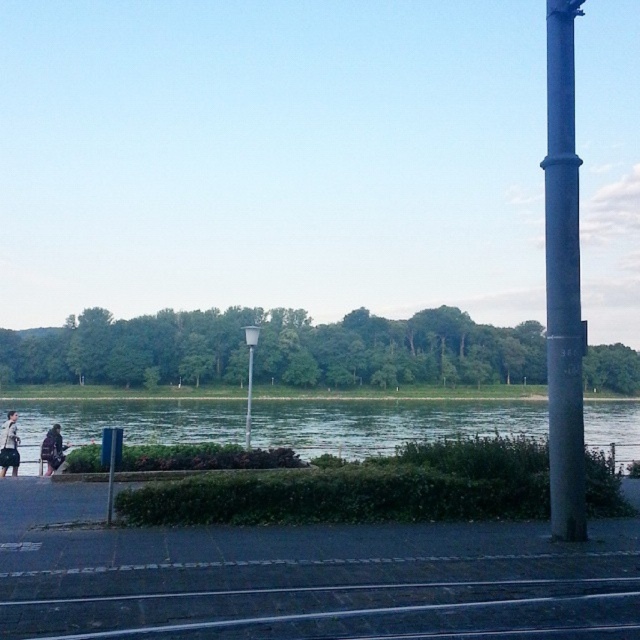
Who is lower down, green grass at lower center or dark brown leather jacket at lower left?

green grass at lower center

Does point (525, 417) come closer to viewer compared to point (12, 445)?

No, it is behind (12, 445).

Image resolution: width=640 pixels, height=640 pixels. I want to click on green grass at lower center, so click(387, 422).

The image size is (640, 640). Describe the element at coordinates (563, 280) in the screenshot. I see `smooth gray pole at right` at that location.

Does smooth gray pole at right have a lesser width compared to dark brown leather jacket at lower left?

No, smooth gray pole at right is not thinner than dark brown leather jacket at lower left.

Identify the location of smooth gray pole at right. The height and width of the screenshot is (640, 640). (563, 280).

Does dark brown leather jacket at lower left appear on the left side of white glossy pole at center?

Yes, dark brown leather jacket at lower left is to the left of white glossy pole at center.

Consider the image. Between dark brown leather jacket at lower left and white glossy pole at center, which one has less height?

dark brown leather jacket at lower left is shorter.

Is point (12, 419) farther from viewer compared to point (248, 448)?

Yes, it is.

I want to click on dark brown leather jacket at lower left, so [x=8, y=445].